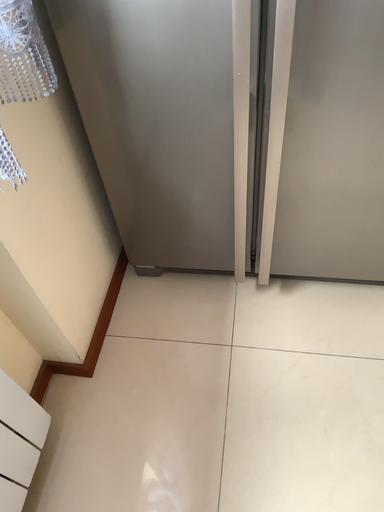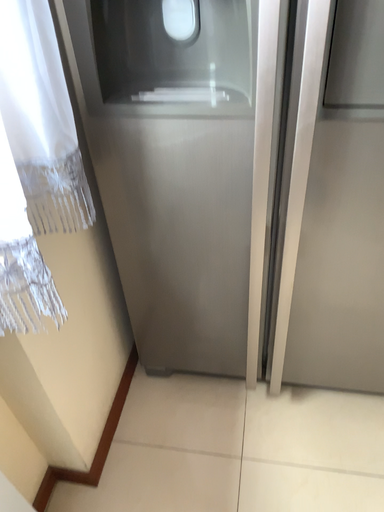
Question: How did the camera likely rotate when shooting the video?

Choices:
 (A) rotated upward
 (B) rotated downward

Answer: (A)